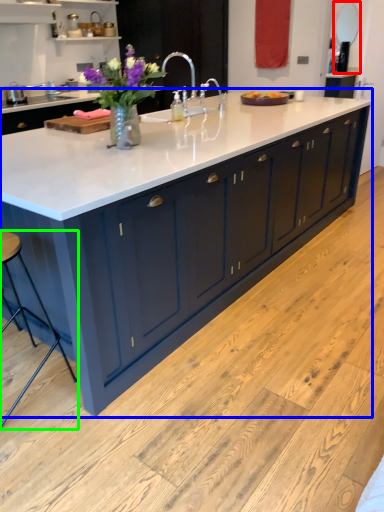
Question: Based on their relative distances, which object is farther from mirror (highlighted by a red box)? Choose from countertop (highlighted by a blue box) and bar stool (highlighted by a green box).

Choices:
 (A) countertop
 (B) bar stool

Answer: (B)